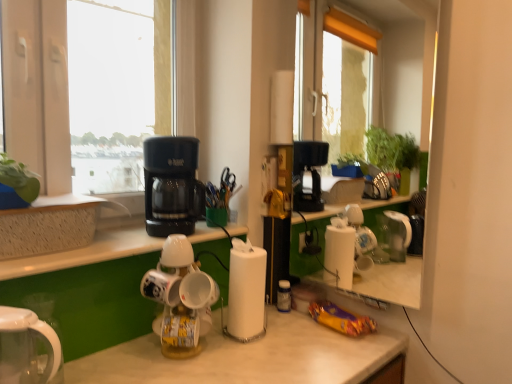
Question: From a real-world perspective, is green leafy plant at upper left physically above white matte cup at center?

Choices:
 (A) yes
 (B) no

Answer: (A)

Question: Is green leafy plant at upper left thinner than white matte cup at center?

Choices:
 (A) no
 (B) yes

Answer: (B)

Question: Is green leafy plant at upper left not near white matte cup at center?

Choices:
 (A) no
 (B) yes

Answer: (A)

Question: Is green leafy plant at upper left facing towards white matte cup at center?

Choices:
 (A) no
 (B) yes

Answer: (A)

Question: Is white matte cup at center at the back of green leafy plant at upper left?

Choices:
 (A) no
 (B) yes

Answer: (A)

Question: Visually, is white glossy kettle at lower left positioned to the left or to the right of translucent plastic bottle at center?

Choices:
 (A) left
 (B) right

Answer: (A)

Question: From a real-world perspective, relative to translucent plastic bottle at center, is white glossy kettle at lower left vertically above or below?

Choices:
 (A) above
 (B) below

Answer: (A)

Question: Is point (2, 317) positioned closer to the camera than point (284, 286)?

Choices:
 (A) closer
 (B) farther

Answer: (A)

Question: In terms of size, does white glossy kettle at lower left appear bigger or smaller than translucent plastic bottle at center?

Choices:
 (A) small
 (B) big

Answer: (B)

Question: From a real-world perspective, is white paper at center physically located above or below textured concrete at left?

Choices:
 (A) above
 (B) below

Answer: (B)

Question: Is white paper at center in front of or behind textured concrete at left in the image?

Choices:
 (A) behind
 (B) front

Answer: (A)

Question: Is white paper at center to the left or to the right of textured concrete at left in the image?

Choices:
 (A) right
 (B) left

Answer: (A)

Question: Considering the positions of white paper at center and textured concrete at left in the image, is white paper at center taller or shorter than textured concrete at left?

Choices:
 (A) tall
 (B) short

Answer: (A)

Question: Looking at the image, does white matte cup at center seem bigger or smaller compared to translucent plastic bottle at center?

Choices:
 (A) small
 (B) big

Answer: (B)

Question: In the image, is white matte cup at center on the left side or the right side of translucent plastic bottle at center?

Choices:
 (A) left
 (B) right

Answer: (A)